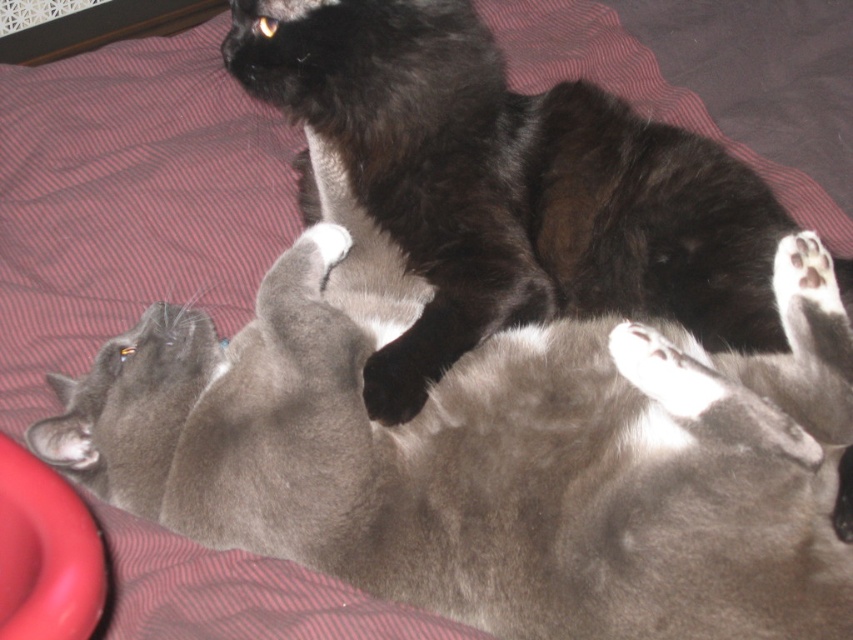
Question: Is the position of soft gray cat at center more distant than that of black fluffy cat at upper center?

Choices:
 (A) no
 (B) yes

Answer: (A)

Question: Does soft gray cat at center appear on the right side of black fluffy cat at upper center?

Choices:
 (A) no
 (B) yes

Answer: (A)

Question: Is soft gray cat at center positioned behind black fluffy cat at upper center?

Choices:
 (A) no
 (B) yes

Answer: (A)

Question: Which point appears closest to the camera in this image?

Choices:
 (A) (518, 195)
 (B) (817, 264)

Answer: (B)